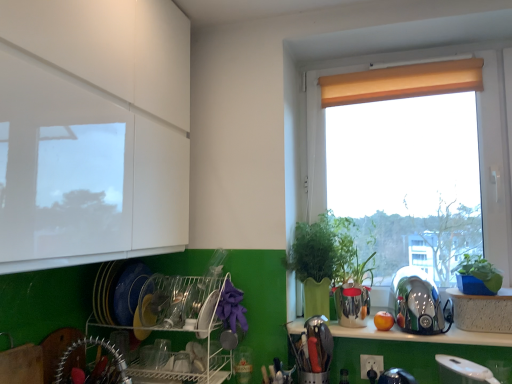
Question: Considering the relative positions of white textured cabinet at lower right and brushed metal utensil rack at lower left, positioned as the first appliance in left-to-right order, in the image provided, is white textured cabinet at lower right behind brushed metal utensil rack at lower left, positioned as the first appliance in left-to-right order,?

Choices:
 (A) yes
 (B) no

Answer: (A)

Question: Considering the relative positions of white textured cabinet at lower right and brushed metal utensil rack at lower left, which is counted as the fourth appliance, starting from the right, in the image provided, is white textured cabinet at lower right to the right of brushed metal utensil rack at lower left, which is counted as the fourth appliance, starting from the right, from the viewer's perspective?

Choices:
 (A) yes
 (B) no

Answer: (A)

Question: From a real-world perspective, is white textured cabinet at lower right positioned over brushed metal utensil rack at lower left, positioned as the first appliance in left-to-right order, based on gravity?

Choices:
 (A) yes
 (B) no

Answer: (A)

Question: Is white textured cabinet at lower right next to brushed metal utensil rack at lower left, which is counted as the fourth appliance, starting from the right, and touching it?

Choices:
 (A) yes
 (B) no

Answer: (B)

Question: Can you confirm if white textured cabinet at lower right is bigger than brushed metal utensil rack at lower left, which is counted as the fourth appliance, starting from the right?

Choices:
 (A) yes
 (B) no

Answer: (A)

Question: Considering the positions of point (492, 322) and point (311, 365), is point (492, 322) closer or farther from the camera than point (311, 365)?

Choices:
 (A) farther
 (B) closer

Answer: (B)

Question: Relative to metallic silver utensil holder at lower center, acting as the 2th appliance starting from the left, is white textured cabinet at lower right in front or behind?

Choices:
 (A) behind
 (B) front

Answer: (A)

Question: Do you think white textured cabinet at lower right is within metallic silver utensil holder at lower center, acting as the third appliance starting from the right, or outside of it?

Choices:
 (A) inside
 (B) outside

Answer: (B)

Question: Considering the positions of white textured cabinet at lower right and metallic silver utensil holder at lower center, acting as the third appliance starting from the right, in the image, is white textured cabinet at lower right wider or thinner than metallic silver utensil holder at lower center, acting as the third appliance starting from the right,?

Choices:
 (A) wide
 (B) thin

Answer: (A)

Question: Considering their positions, is green plastic pot at right located in front of or behind matte beige roller shade at upper right?

Choices:
 (A) front
 (B) behind

Answer: (A)

Question: Considering the positions of green plastic pot at right and matte beige roller shade at upper right in the image, is green plastic pot at right wider or thinner than matte beige roller shade at upper right?

Choices:
 (A) wide
 (B) thin

Answer: (A)

Question: From a real-world perspective, is green plastic pot at right positioned above or below matte beige roller shade at upper right?

Choices:
 (A) below
 (B) above

Answer: (A)

Question: In the image, is green plastic pot at right on the left side or the right side of matte beige roller shade at upper right?

Choices:
 (A) left
 (B) right

Answer: (B)

Question: From a real-world perspective, is beige fabric curtain at upper right physically located above or below brushed metal utensil rack at lower left, which is counted as the fourth appliance, starting from the right?

Choices:
 (A) below
 (B) above

Answer: (B)

Question: Considering the positions of beige fabric curtain at upper right and brushed metal utensil rack at lower left, positioned as the first appliance in left-to-right order, in the image, is beige fabric curtain at upper right bigger or smaller than brushed metal utensil rack at lower left, positioned as the first appliance in left-to-right order,?

Choices:
 (A) big
 (B) small

Answer: (A)